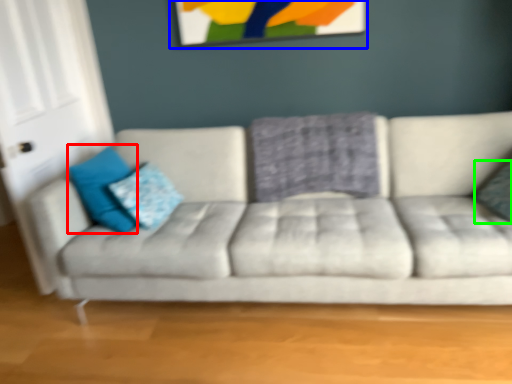
Question: Considering the real-world distances, which object is farthest from pillow (highlighted by a red box)? picture frame (highlighted by a blue box) or pillow (highlighted by a green box)?

Choices:
 (A) picture frame
 (B) pillow

Answer: (B)